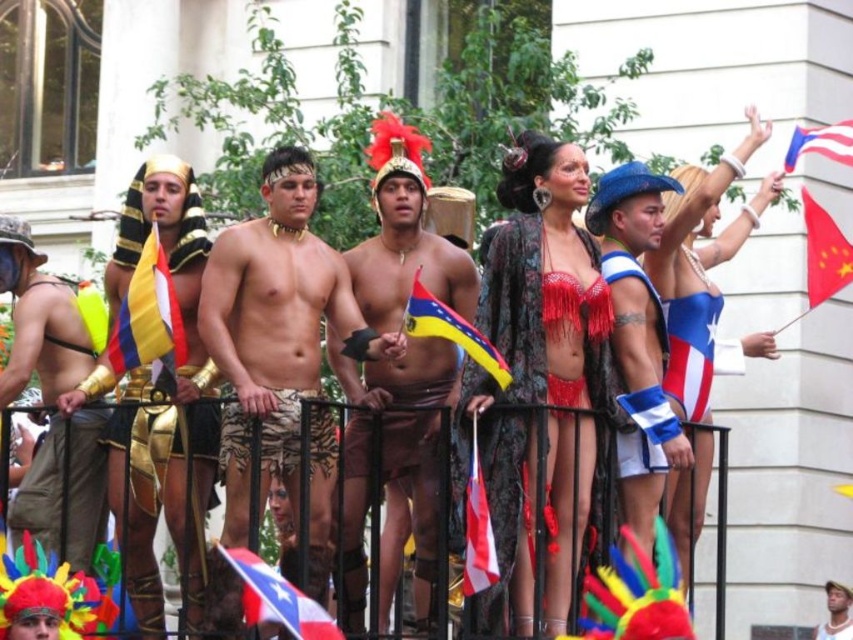
You are a photographer at the event and want to capture both the yellow and blue fabric flag at left and the white matte hat at upper center in a single shot. Which object should you focus on first to ensure both are in the frame?

Since the yellow and blue fabric flag at left is larger in size than the white matte hat at upper center, you should focus on the yellow and blue fabric flag at left first to ensure both objects are included in the frame.

You are a photographer at the event and want to capture a photo of the blue and white fabric flag at center without any obstructions. Is the camouflage shorts at center blocking the view of the flag?

The camouflage shorts at center is in front of the blue and white fabric flag at center, so it is blocking the view of the flag. Move to a position where the camouflage shorts at center is not in front of the flag to capture an unobstructed view.